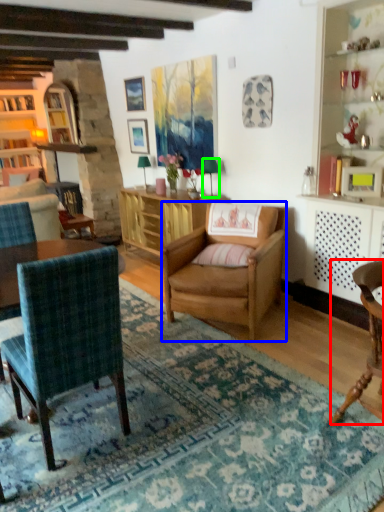
Question: Based on their relative distances, which object is farther from chair (highlighted by a red box)? Choose from chair (highlighted by a blue box) and lamp (highlighted by a green box).

Choices:
 (A) chair
 (B) lamp

Answer: (B)